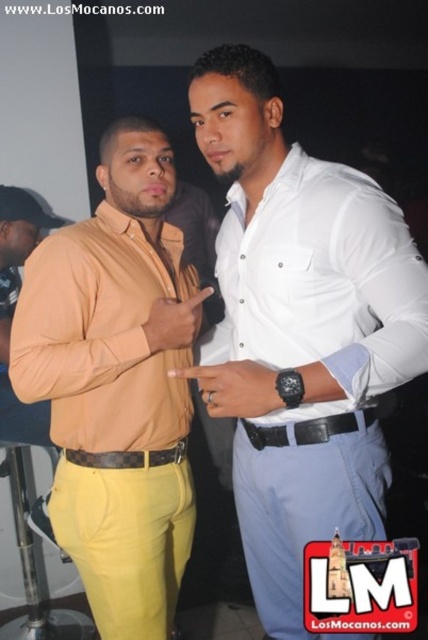
You are organizing a photo shoot and need to ensure that the white smooth shirt at center and the brown leather belt at center are both visible in the frame. Given their sizes, which one might require more space in the composition?

The white smooth shirt at center is larger in size than the brown leather belt at center, so it would require more space in the composition.

You are a photographer adjusting the camera settings to capture a closeup of the white smooth shirt at center and the black leather belt at center. The camera has a depth of field that can focus on objects within a 10 inch range. Will both items be in focus?

The white smooth shirt at center and black leather belt at center are 9.77 inches apart from each other. Since the distance between them is within the 10 inch range of the camera, both items will be in focus.

You are a photographer standing at the camera position. You want to take a closeup shot of the black leather belt at center without moving the camera. Is it possible to zoom in enough to capture the belt clearly?

The black leather belt at center is 1.15 meters from the camera. Depending on the camera lens, if it has sufficient zoom capability to focus on objects at that distance, then yes, you can capture it clearly. However, if the zoom range is limited, you might need to adjust the lens or use a different camera setting.